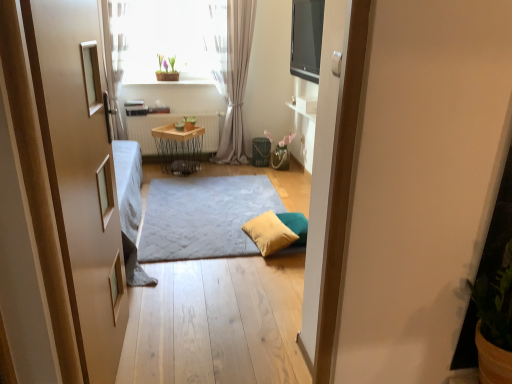
Find the location of `vacant space in front of light gray sheer curtain at center`. vacant space in front of light gray sheer curtain at center is located at coordinates (223, 170).